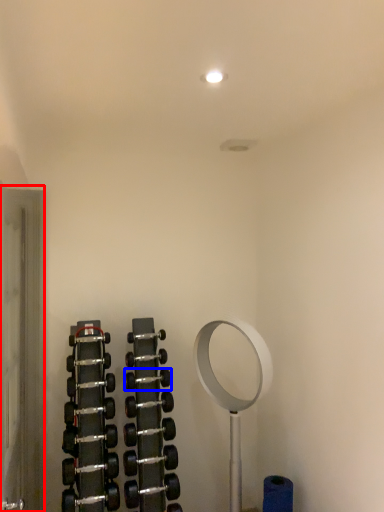
Question: Which point is closer to the camera, glass door (highlighted by a red box) or dumbbell (highlighted by a blue box)?

Choices:
 (A) glass door
 (B) dumbbell

Answer: (A)